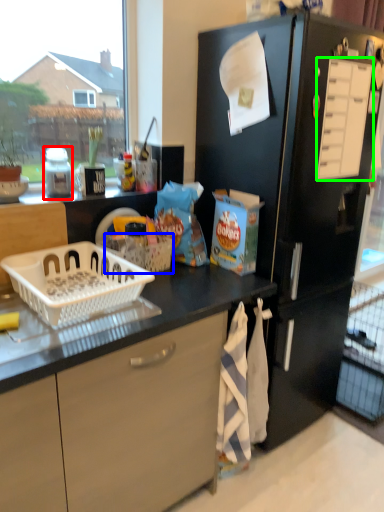
Question: Which object is positioned closest to bottle (highlighted by a red box)? Select from basket (highlighted by a blue box) and drawer (highlighted by a green box).

Choices:
 (A) basket
 (B) drawer

Answer: (A)